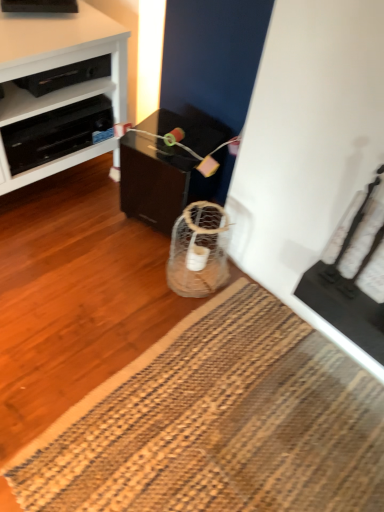
Question: Should I look upward or downward to see black plastic shelf at upper left?

Choices:
 (A) up
 (B) down

Answer: (A)

Question: Can you confirm if white glossy cabinet at left is bigger than black glossy table at center?

Choices:
 (A) yes
 (B) no

Answer: (A)

Question: Does white glossy cabinet at left have a greater width compared to black glossy table at center?

Choices:
 (A) yes
 (B) no

Answer: (A)

Question: Considering the relative positions of white glossy cabinet at left and black glossy table at center in the image provided, is white glossy cabinet at left to the right of black glossy table at center from the viewer's perspective?

Choices:
 (A) no
 (B) yes

Answer: (A)

Question: Is white glossy cabinet at left positioned in front of black glossy table at center?

Choices:
 (A) yes
 (B) no

Answer: (A)

Question: Considering the relative sizes of white glossy cabinet at left and black glossy table at center in the image provided, is white glossy cabinet at left thinner than black glossy table at center?

Choices:
 (A) no
 (B) yes

Answer: (A)

Question: Is black glossy table at center at the back of white glossy cabinet at left?

Choices:
 (A) yes
 (B) no

Answer: (B)

Question: From the image's perspective, is black plastic drawer at upper left located beneath white glossy cabinet at left?

Choices:
 (A) yes
 (B) no

Answer: (A)

Question: Is black plastic drawer at upper left bigger than white glossy cabinet at left?

Choices:
 (A) no
 (B) yes

Answer: (A)

Question: From the image's perspective, is black plastic drawer at upper left on top of white glossy cabinet at left?

Choices:
 (A) no
 (B) yes

Answer: (A)

Question: Is black plastic drawer at upper left thinner than white glossy cabinet at left?

Choices:
 (A) yes
 (B) no

Answer: (A)

Question: Is black plastic drawer at upper left positioned before white glossy cabinet at left?

Choices:
 (A) yes
 (B) no

Answer: (B)

Question: Is black plastic drawer at upper left not inside white glossy cabinet at left?

Choices:
 (A) yes
 (B) no

Answer: (B)

Question: Considering the relative sizes of black plastic shelf at upper left and natural fiber mat at lower center in the image provided, is black plastic shelf at upper left smaller than natural fiber mat at lower center?

Choices:
 (A) no
 (B) yes

Answer: (B)